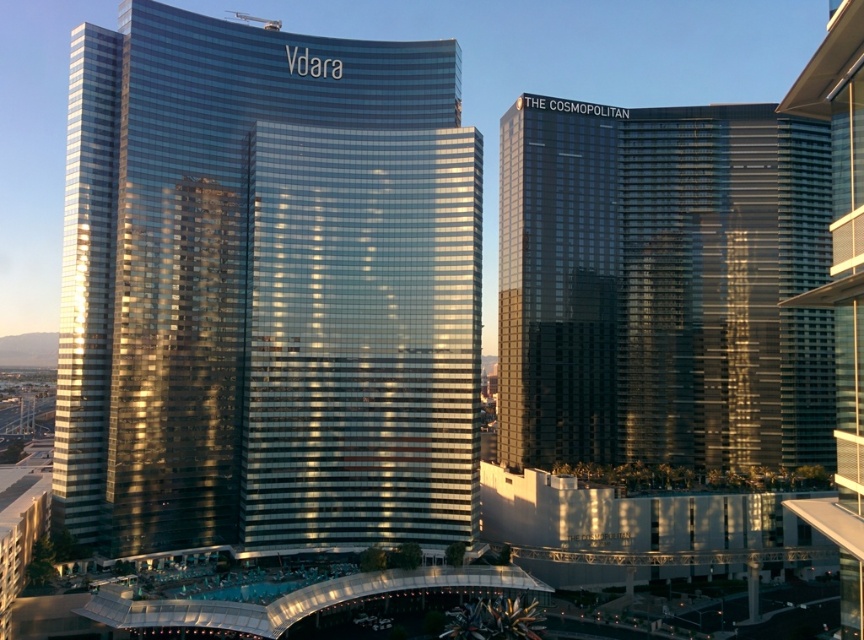
Looking at this image, you are a drone operator tasked with capturing aerial footage of two shiny glass buildings in a city. You need to ensure that both the shiny glass building at center and the shiny glass building at right are visible in your shot. Based on their positions, which building should you focus on first to frame them properly?

The shiny glass building at center is located above the shiny glass building at right, so you should focus on the shiny glass building at center first to ensure both are framed properly in the aerial shot.

You are standing in the middle of the city square between Vdara and THE COSMOPOLITAN. You see a point at coordinates point (265, 289). Which building is this point located on?

The point (265, 289) is located on the shiny glass building at center, which is THE COSMOPOLITAN.

structural integrity is a concern when designing tall buildings. considering the shiny glass building at center and the shiny glass building at right, which one might require more wind resistance engineering?

structural integrity is crucial for tall buildings. the shiny glass building at right is larger than the shiny glass building at center. larger buildings typically face greater wind forces, so the shiny glass building at right would likely require more advanced wind resistance engineering to maintain stability under high winds.